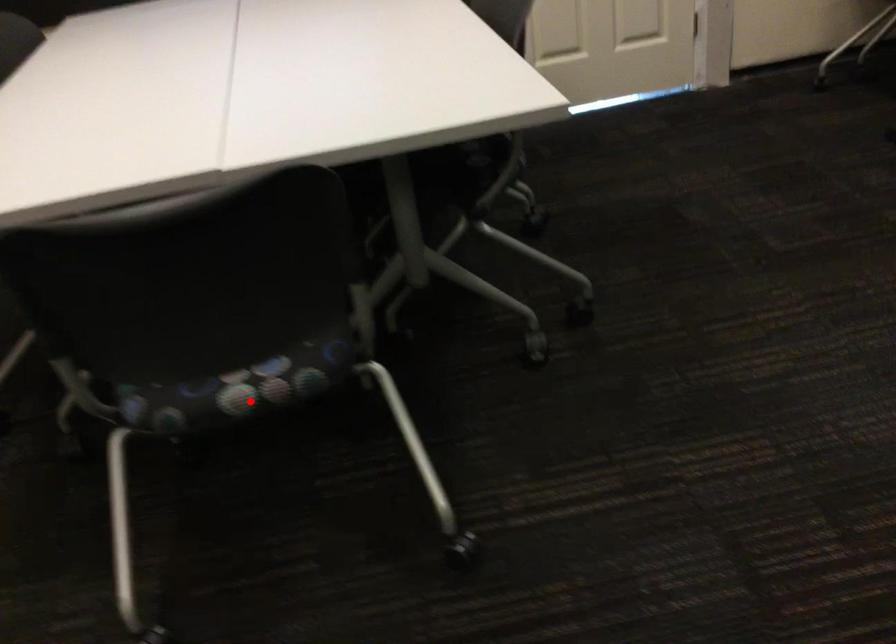
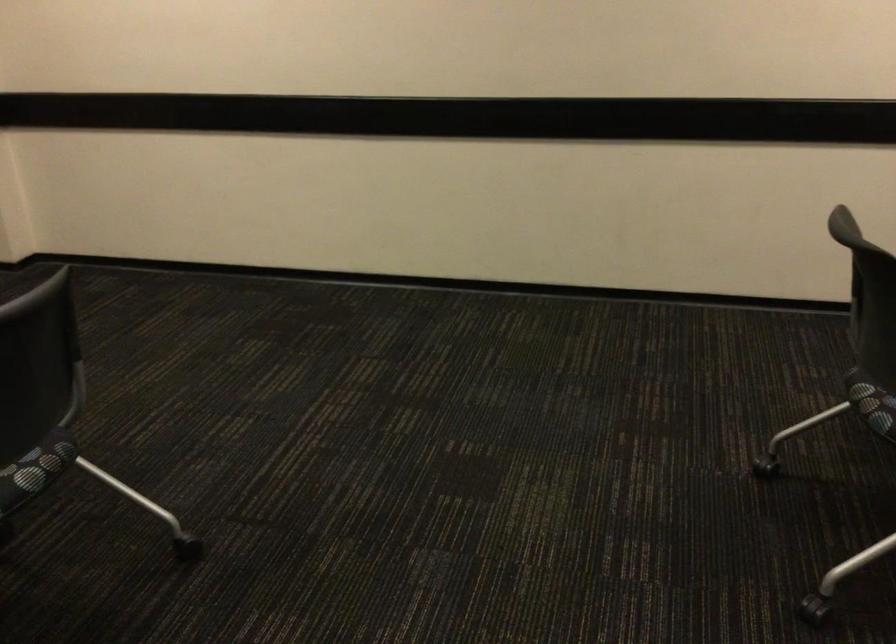
Question: I am providing you with two images of the same scene from different viewpoints. Image1 has a red point marked. In image2, the corresponding 3D location appears at what relative position? Reply with the corresponding letter.

Choices:
 (A) Closer
 (B) Farther

Answer: (B)